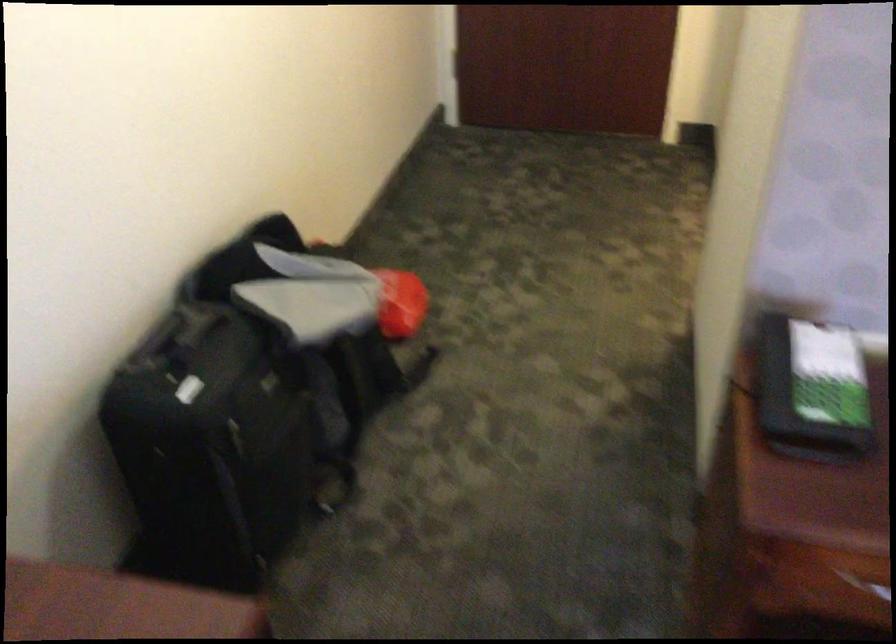
Locate an element on the screen. The height and width of the screenshot is (644, 896). black luggage handle is located at coordinates (160, 333).